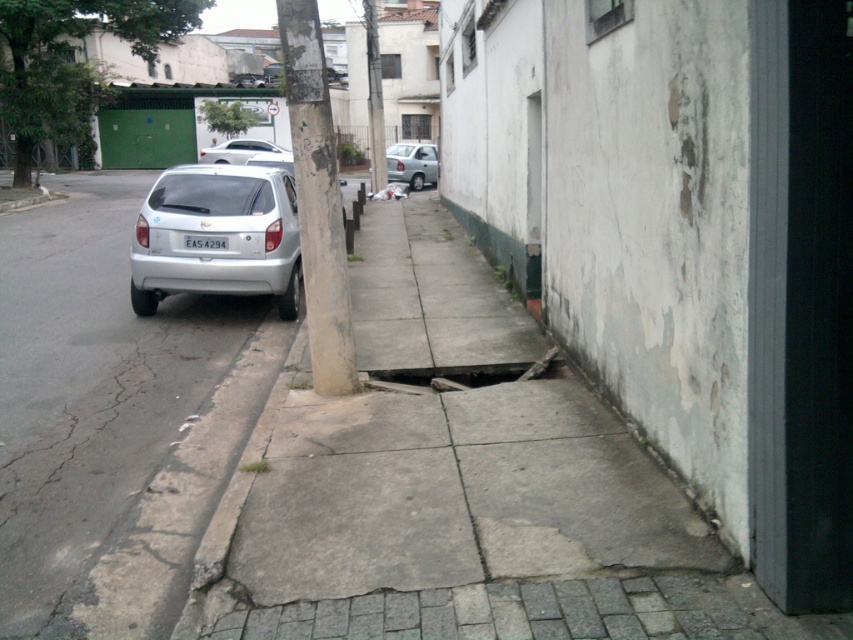
Question: Which is farther from the silver metallic hatchback at center?

Choices:
 (A) white plastic license plate at center
 (B) green leafy tree at upper left
 (C) concrete pole at center
 (D) white matte car at center

Answer: (C)

Question: Can you confirm if rusty metal hole at center is thinner than smooth concrete pole at center?

Choices:
 (A) yes
 (B) no

Answer: (A)

Question: Which object appears farthest from the camera in this image?

Choices:
 (A) white matte car at center
 (B) green leafy tree at upper left

Answer: (B)

Question: Can you confirm if rusty metal hole at center is positioned above smooth concrete pole at center?

Choices:
 (A) yes
 (B) no

Answer: (B)

Question: Considering the relative positions of white matte hatchback at center-left and white matte sedan at center in the image provided, where is white matte hatchback at center-left located with respect to white matte sedan at center?

Choices:
 (A) left
 (B) right

Answer: (B)

Question: Which point is farther from the camera taking this photo?

Choices:
 (A) (48, 92)
 (B) (370, 188)
 (C) (192, 241)
 (D) (210, 282)

Answer: (B)